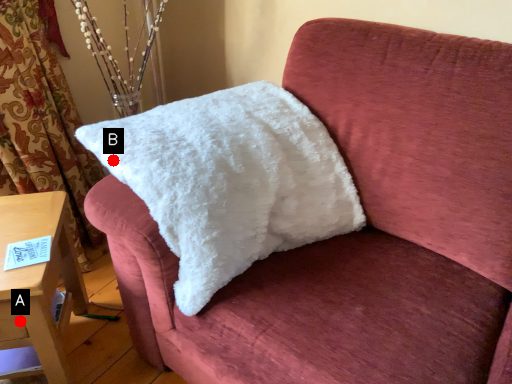
Question: Two points are circled on the image, labeled by A and B beside each circle. Which of the following is the farthest from the observer?

Choices:
 (A) A is further
 (B) B is further

Answer: (A)